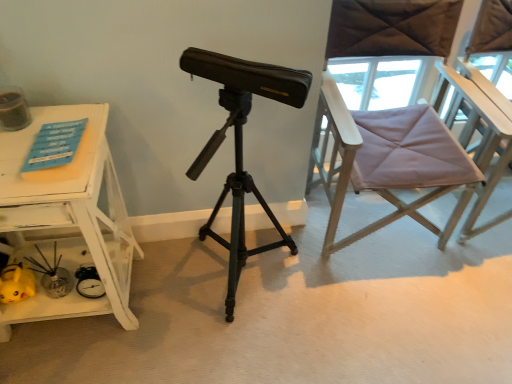
The width and height of the screenshot is (512, 384). I want to click on vacant space that is in between white painted wood table at left and matte black tripod at center, so click(175, 292).